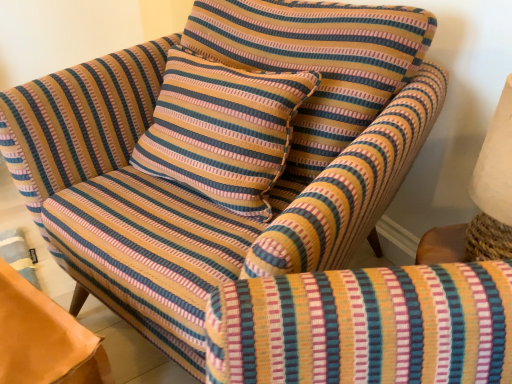
Locate an element on the screen. beige fabric lampshade at upper right is located at coordinates (482, 201).

Describe the element at coordinates (482, 201) in the screenshot. The image size is (512, 384). I see `beige fabric lampshade at upper right` at that location.

This screenshot has width=512, height=384. Find the location of `beige fabric lampshade at upper right`. beige fabric lampshade at upper right is located at coordinates (482, 201).